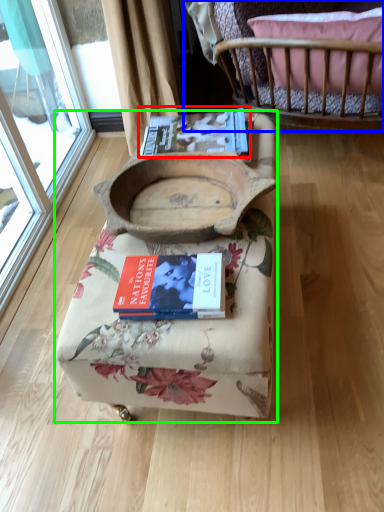
Question: Considering the real-world distances, which object is farthest from paperback book (highlighted by a red box)? furniture (highlighted by a blue box) or furniture (highlighted by a green box)?

Choices:
 (A) furniture
 (B) furniture

Answer: (A)